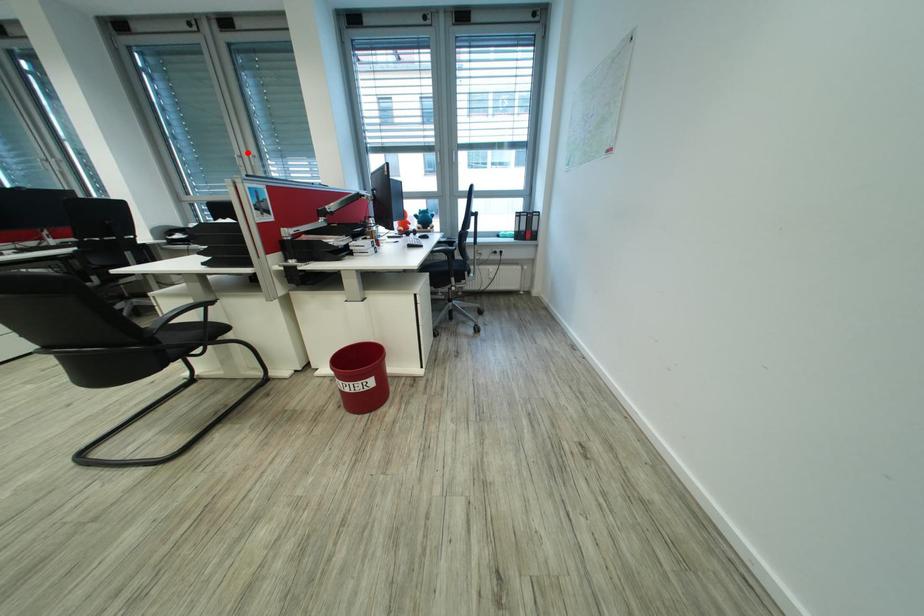
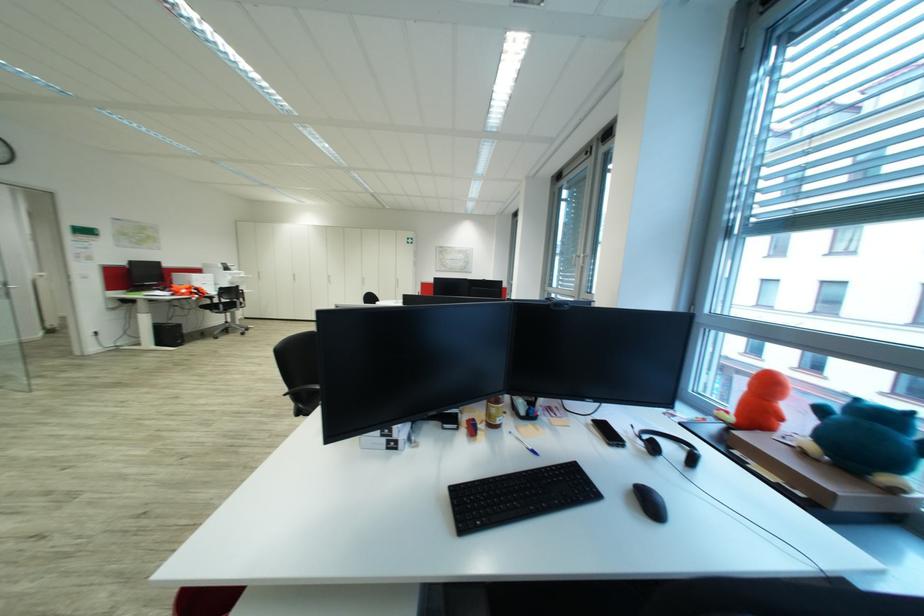
In the second image, find the point that corresponds to the highlighted location in the first image.

(582, 253)